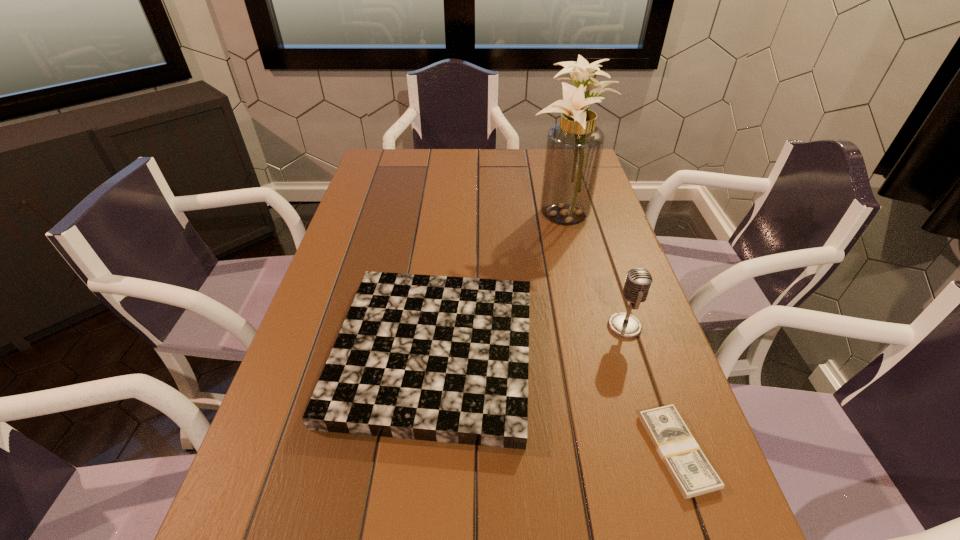
Image resolution: width=960 pixels, height=540 pixels. What are the coordinates of `free space between the dollar and the second shortest object` in the screenshot? It's located at (555, 402).

Where is `empty space that is in between the leftmost object and the microphone`? The height and width of the screenshot is (540, 960). empty space that is in between the leftmost object and the microphone is located at coordinates (529, 339).

I want to click on vacant space in between the second shortest object and the microphone, so click(529, 339).

Find the location of a particular element. free space between the microphone and the tallest object is located at coordinates (593, 270).

You are a GUI agent. You are given a task and a screenshot of the screen. Output one action in this format:
    pyautogui.click(x=<x>, y=<y>)
    Task: Click on the vacant point located between the dollar and the third shortest object
    
    Given the screenshot: What is the action you would take?
    pyautogui.click(x=651, y=389)

Image resolution: width=960 pixels, height=540 pixels. What are the coordinates of `free space between the second tallest object and the dollar` in the screenshot? It's located at (651, 389).

What are the coordinates of `the second closest object to the tallest object` in the screenshot? It's located at 638,282.

The image size is (960, 540). Find the location of `object that is the closest one to the tallest object`. object that is the closest one to the tallest object is located at coordinates point(437,358).

This screenshot has width=960, height=540. In order to click on free spot that satisfies the following two spatial constraints: 1. on the back side of the leftmost object; 2. on the left side of the third shortest object in this screenshot , I will do `click(437, 326)`.

At what (x,y) coordinates should I click in order to perform the action: click on vacant space that satisfies the following two spatial constraints: 1. on the front side of the microphone; 2. on the left side of the tallest object. Please return your answer as a coordinate pair (x, y). This screenshot has width=960, height=540. Looking at the image, I should click on (589, 326).